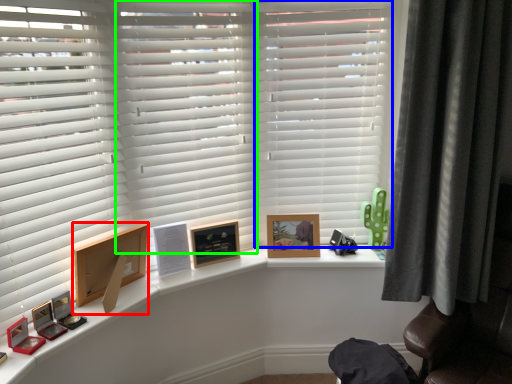
Question: Based on their relative distances, which object is nearer to picture frame (highlighted by a red box)? Choose from shutter (highlighted by a blue box) and shutter (highlighted by a green box).

Choices:
 (A) shutter
 (B) shutter

Answer: (B)